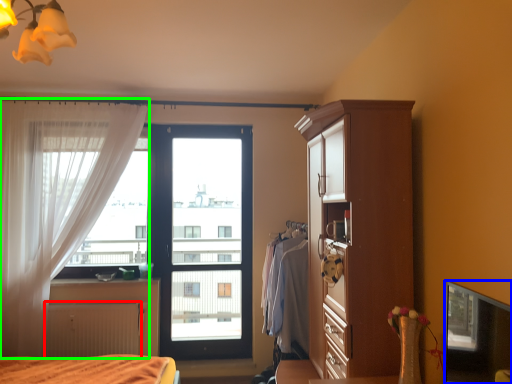
Question: Estimate the real-world distances between objects in this image. Which object is farther from radiator (highlighted by a red box), window screen (highlighted by a blue box) or curtain (highlighted by a green box)?

Choices:
 (A) window screen
 (B) curtain

Answer: (A)